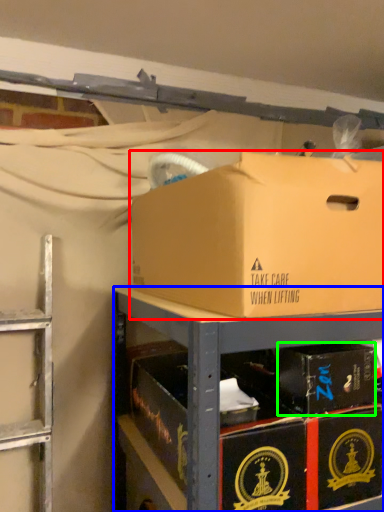
Question: Which is farther away from box (highlighted by a red box)? shelf (highlighted by a blue box) or box (highlighted by a green box)?

Choices:
 (A) shelf
 (B) box

Answer: (B)